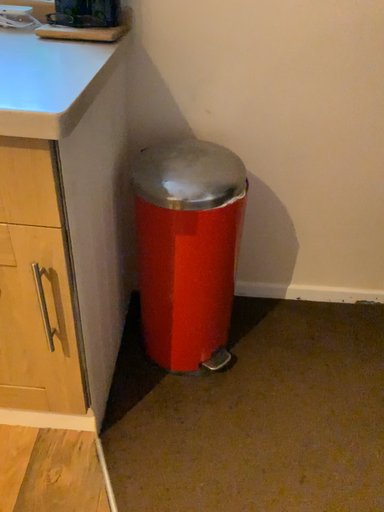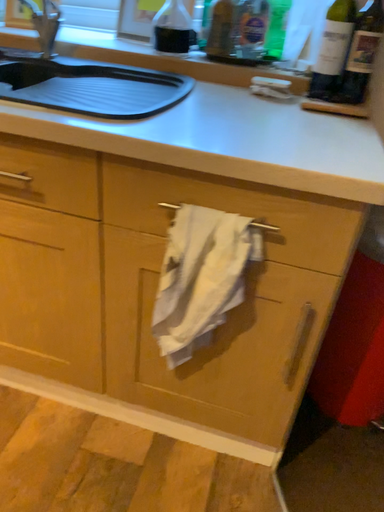
Question: How did the camera likely rotate when shooting the video?

Choices:
 (A) rotated upward
 (B) rotated downward

Answer: (A)